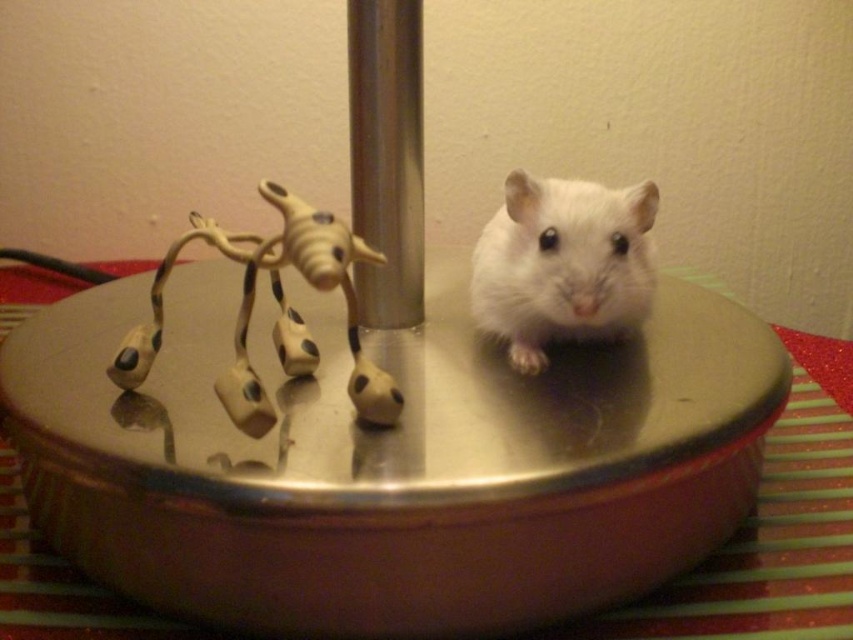
Question: Can you confirm if white fur hamster at center is positioned below silver metallic pole at center?

Choices:
 (A) yes
 (B) no

Answer: (A)

Question: Which object appears farthest from the camera in this image?

Choices:
 (A) white fur hamster at center
 (B) silver metallic pole at center

Answer: (B)

Question: Is white fur hamster at center above silver metallic pole at center?

Choices:
 (A) yes
 (B) no

Answer: (B)

Question: Is white fur hamster at center wider than silver metallic pole at center?

Choices:
 (A) yes
 (B) no

Answer: (A)